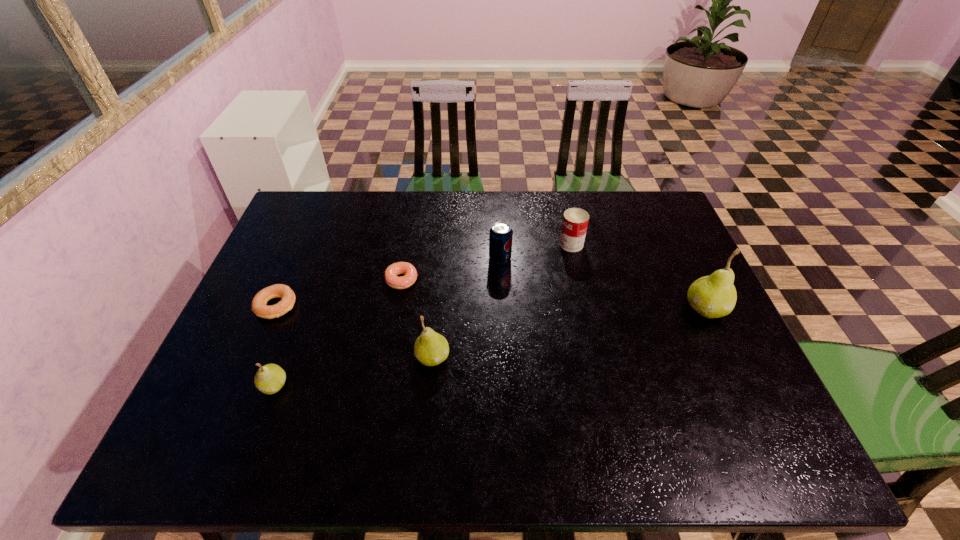
The width and height of the screenshot is (960, 540). I want to click on object that can be found as the fifth closest to the fifth object from left to right, so click(x=259, y=303).

Point out which object is positioned as the second nearest to the nearest object. Please provide its 2D coordinates. Your answer should be formatted as a tuple, i.e. [(x, y)], where the tuple contains the x and y coordinates of a point satisfying the conditions above.

[(431, 348)]

Identify which pear is the closest to the tallest pear. Please provide its 2D coordinates. Your answer should be formatted as a tuple, i.e. [(x, y)], where the tuple contains the x and y coordinates of a point satisfying the conditions above.

[(431, 348)]

Find the location of a particular element. the third closest pear relative to the sixth object from left to right is located at coordinates (270, 378).

Where is `free space that satisfies the following two spatial constraints: 1. on the front side of the bagel; 2. on the right side of the nearest object`? free space that satisfies the following two spatial constraints: 1. on the front side of the bagel; 2. on the right side of the nearest object is located at coordinates (242, 386).

The image size is (960, 540). In order to click on free location that satisfies the following two spatial constraints: 1. on the back side of the shortest pear; 2. on the right side of the third object from left to right in this screenshot , I will do [x=314, y=280].

You are a GUI agent. You are given a task and a screenshot of the screen. Output one action in this format:
    pyautogui.click(x=<x>, y=<y>)
    Task: Click on the free space that satisfies the following two spatial constraints: 1. on the back side of the bagel; 2. on the right side of the doughnut
    The width and height of the screenshot is (960, 540).
    Given the screenshot: What is the action you would take?
    pyautogui.click(x=287, y=280)

This screenshot has height=540, width=960. In order to click on vacant position in the image that satisfies the following two spatial constraints: 1. on the back side of the nearest object; 2. on the left side of the tallest object in this screenshot , I will do `click(302, 308)`.

The width and height of the screenshot is (960, 540). What are the coordinates of `vacant space that satisfies the following two spatial constraints: 1. on the back side of the tallest pear; 2. on the front label of the second object from right to left` in the screenshot? It's located at (675, 244).